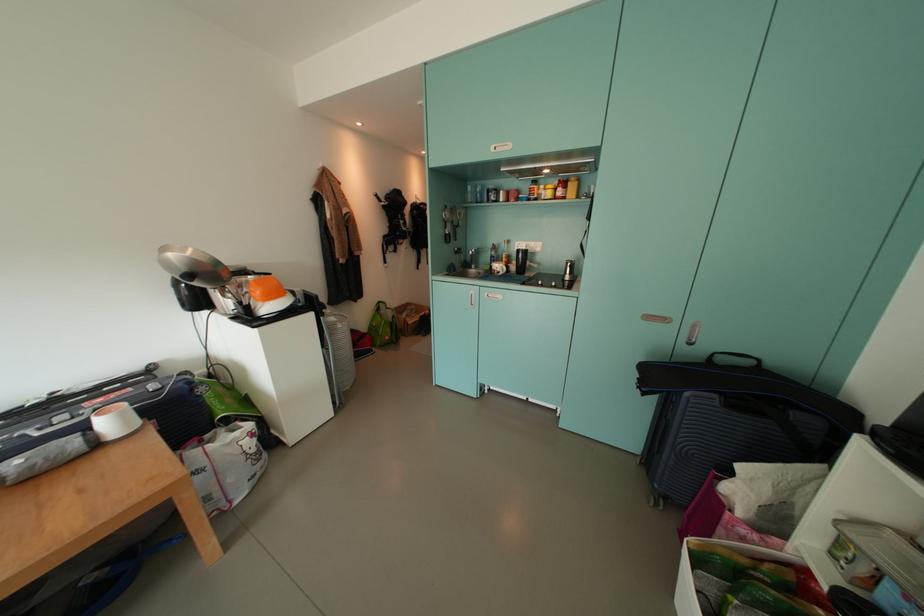
Locate an element on the screen. The image size is (924, 616). white bowl is located at coordinates (115, 422).